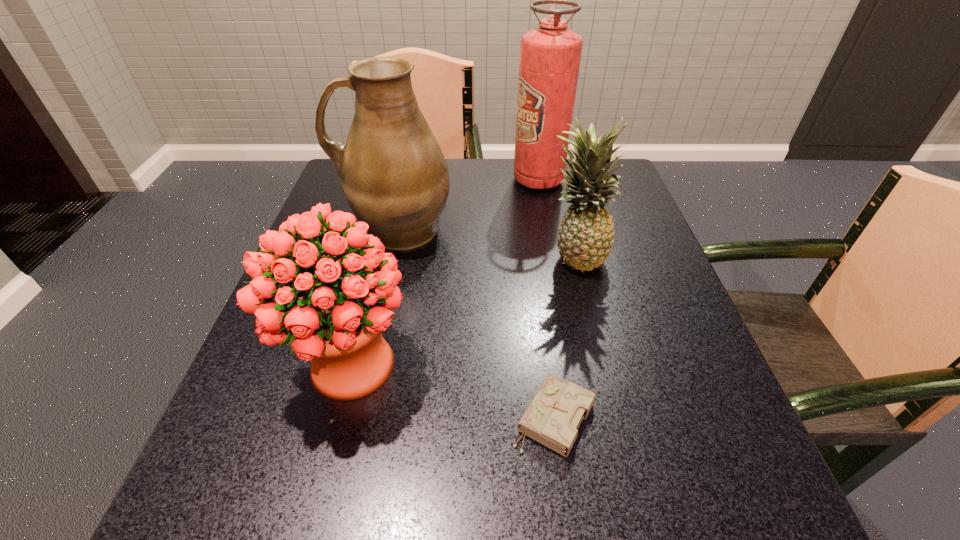
Where is `vacant area that lies between the farthest object and the shortest object`? vacant area that lies between the farthest object and the shortest object is located at coordinates 546,299.

Locate an element on the screen. vacant point located between the fire extinguisher and the pitcher is located at coordinates (468, 204).

At what (x,y) coordinates should I click in order to perform the action: click on empty space that is in between the bouquet and the shortest object. Please return your answer as a coordinate pair (x, y). This screenshot has height=540, width=960. Looking at the image, I should click on (452, 392).

Find the location of a particular element. free spot between the pineapple and the farthest object is located at coordinates (556, 218).

This screenshot has height=540, width=960. Find the location of `vacant point located between the pitcher and the diary`. vacant point located between the pitcher and the diary is located at coordinates (475, 323).

At what (x,y) coordinates should I click in order to perform the action: click on object that stands as the closest to the shortest object. Please return your answer as a coordinate pair (x, y). Image resolution: width=960 pixels, height=540 pixels. Looking at the image, I should click on (337, 323).

At what (x,y) coordinates should I click in order to perform the action: click on object that is the fourth nearest to the pineapple. Please return your answer as a coordinate pair (x, y). The height and width of the screenshot is (540, 960). Looking at the image, I should click on (337, 323).